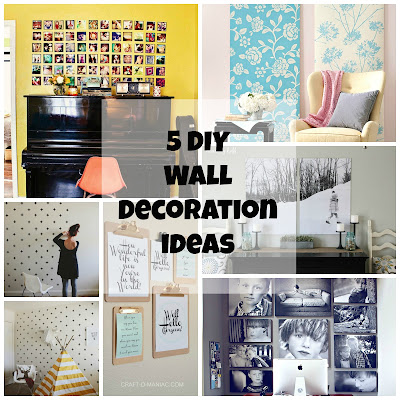
Locate an element on the screen. The image size is (400, 400). white candles on black candle holders is located at coordinates (340, 225), (351, 219), (258, 229), (241, 219).